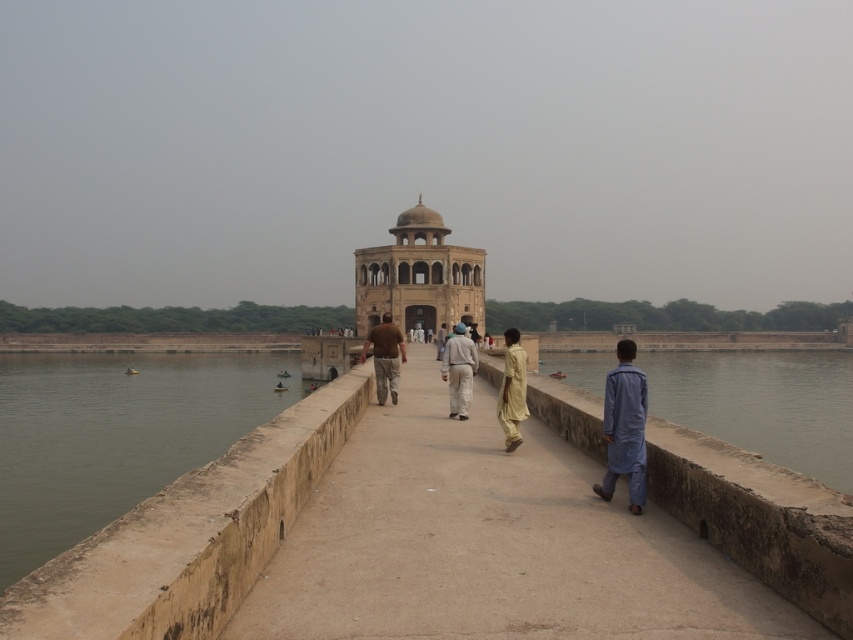
In the scene shown: You are standing on the bridge leading to the historic structure and want to reach the point closer to you. Which of the two points, point (254, 376) or point (436, 337), should you aim for?

You should aim for point (254, 376) because it is closer to you than point (436, 337).

You are a tourist standing on the bridge and see the beige stone palace at center and the blue cotton shirt at right. Which object is positioned to the east side of the other?

The beige stone palace at center is to the left of blue cotton shirt at right, so the beige stone palace at center is positioned to the east side if the blue cotton shirt at right is on the west side.